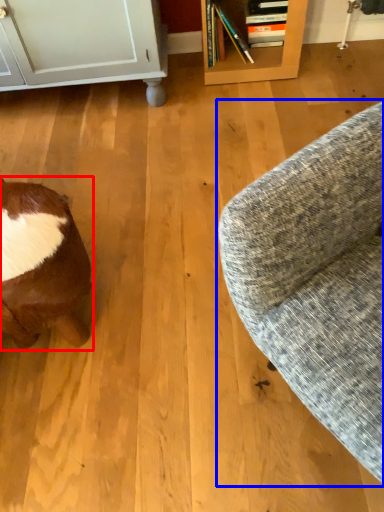
Question: Which object is further to the camera taking this photo, animal (highlighted by a red box) or studio couch (highlighted by a blue box)?

Choices:
 (A) animal
 (B) studio couch

Answer: (A)